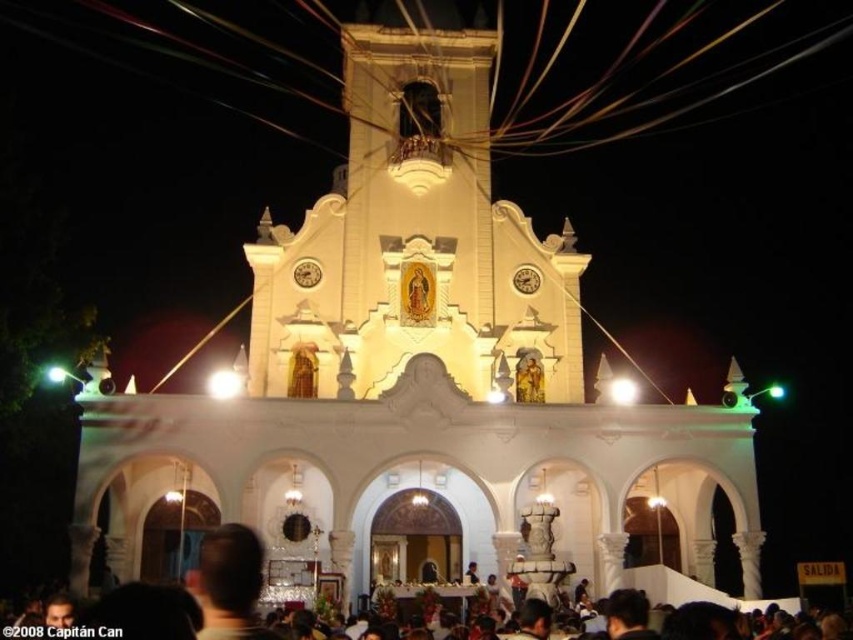
Question: Can you confirm if metallic wire at upper center is positioned to the right of black matte crowd at lower center?

Choices:
 (A) no
 (B) yes

Answer: (A)

Question: From the image, what is the correct spatial relationship of metallic wire at upper center in relation to black matte crowd at lower center?

Choices:
 (A) left
 (B) right

Answer: (A)

Question: Which point is closer to the camera taking this photo?

Choices:
 (A) (194, 576)
 (B) (532, 32)

Answer: (A)

Question: Can you confirm if metallic wire at upper center is bigger than black matte crowd at lower center?

Choices:
 (A) no
 (B) yes

Answer: (B)